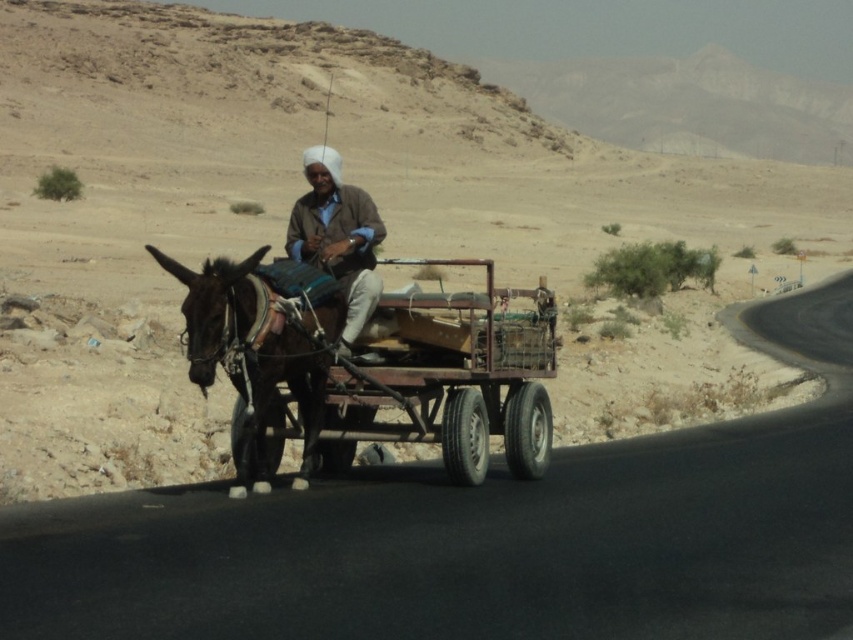
Which is more to the left, rustic wooden cart at center or shiny black horse at center?

From the viewer's perspective, shiny black horse at center appears more on the left side.

What do you see at coordinates (369, 365) in the screenshot?
I see `rustic wooden cart at center` at bounding box center [369, 365].

Is point (260, 355) positioned after point (229, 264)?

That is True.

Where is `rustic wooden cart at center`? rustic wooden cart at center is located at coordinates (369, 365).

Is rustic wooden cart at center smaller than brown woolen sweater at center?

Actually, rustic wooden cart at center might be larger than brown woolen sweater at center.

This screenshot has height=640, width=853. In order to click on rustic wooden cart at center in this screenshot , I will do `click(369, 365)`.

Which of these two, shiny black horse at center or brown woolen sweater at center, stands taller?

shiny black horse at center

Does shiny black horse at center appear on the right side of brown woolen sweater at center?

In fact, shiny black horse at center is to the left of brown woolen sweater at center.

Between point (181, 272) and point (350, 276), which one is positioned in front?

Point (181, 272) is more forward.

I want to click on shiny black horse at center, so click(x=254, y=355).